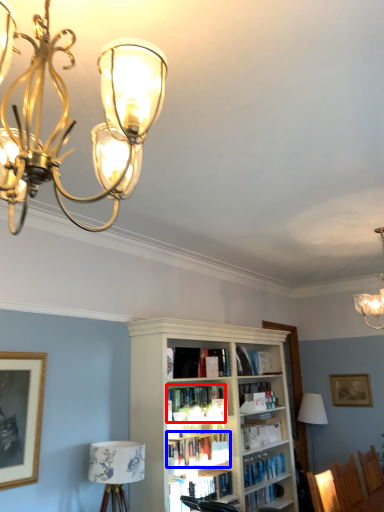
Question: Which object is closer to the camera taking this photo, book (highlighted by a red box) or book (highlighted by a blue box)?

Choices:
 (A) book
 (B) book

Answer: (B)